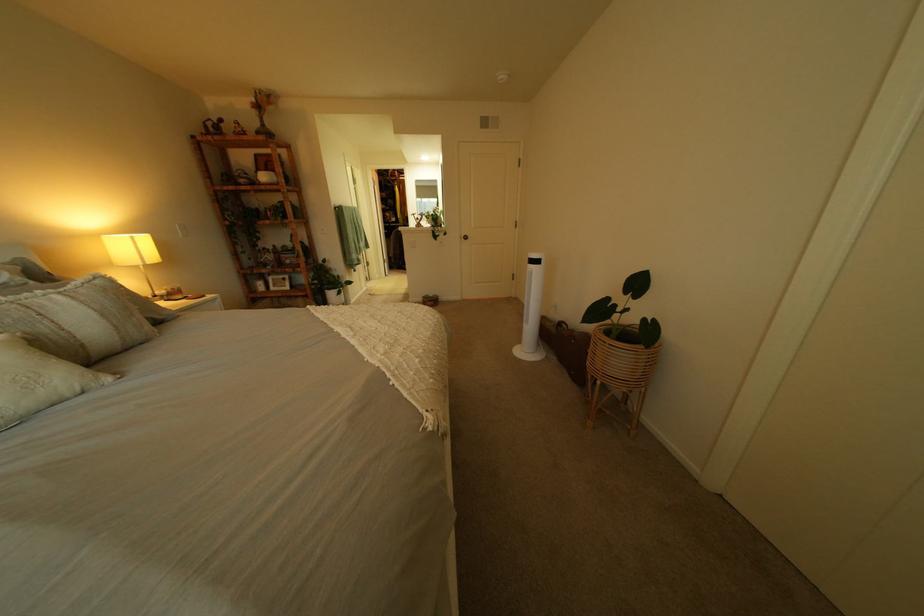
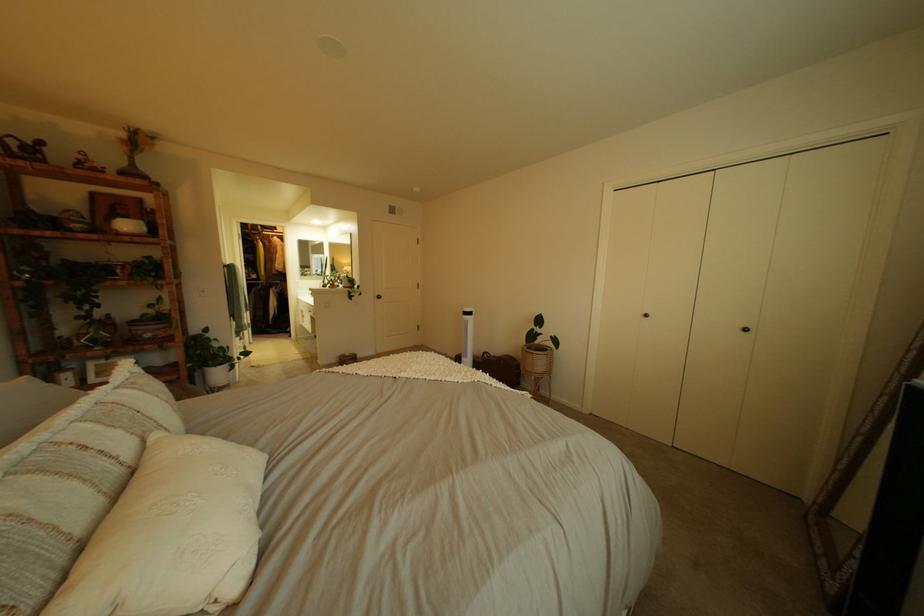
Find the pixel in the second image that matches point (320, 294) in the first image.

(189, 379)